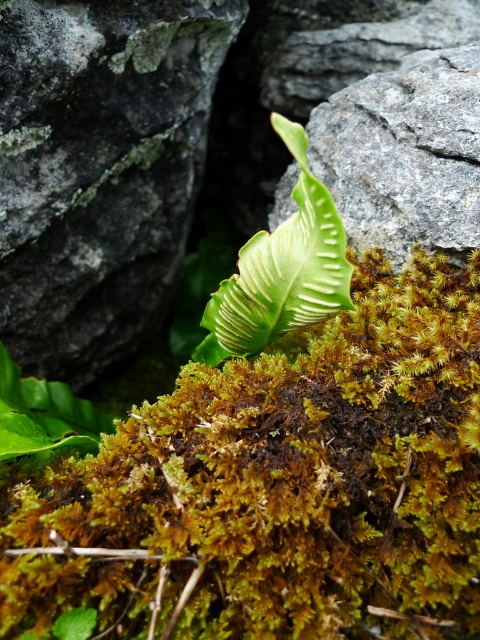
Between gray rough boulder at center and green matte leaf at center, which one has more height?

With more height is gray rough boulder at center.

Is gray rough boulder at center smaller than green matte leaf at center?

Actually, gray rough boulder at center might be larger than green matte leaf at center.

Who is more forward, (76, 84) or (205, 339)?

Point (205, 339) is in front.

You are a GUI agent. You are given a task and a screenshot of the screen. Output one action in this format:
    pyautogui.click(x=<x>, y=<y>)
    Task: Click on the gray rough boulder at center
    This screenshot has height=640, width=480.
    Given the screenshot: What is the action you would take?
    pyautogui.click(x=99, y=170)